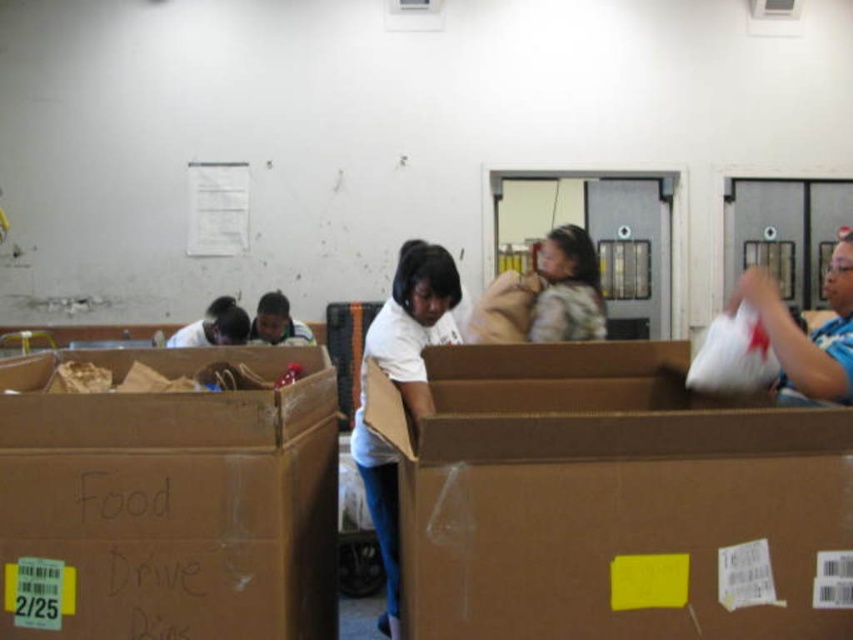
You are a volunteer at the food distribution event. You need to move the brown cardboard box at center to a storage area 3 meters away. Can you safely move it without needing to adjust your position relative to the matte white shirt at center?

The brown cardboard box at center is 2.58 meters from the matte white shirt at center. Since the storage area is 3 meters away, you can move the box without needing to adjust your position because the distance required is slightly more than the current separation between the box and the shirt.

From the picture: You are standing at the entrance of the room and want to move towards the brown cardboard box at center. Which direction should you walk to reach it?

Since the brown cardboard box at center is located at point [614,500] in the 2D space, you should walk towards the center of the room to reach it.